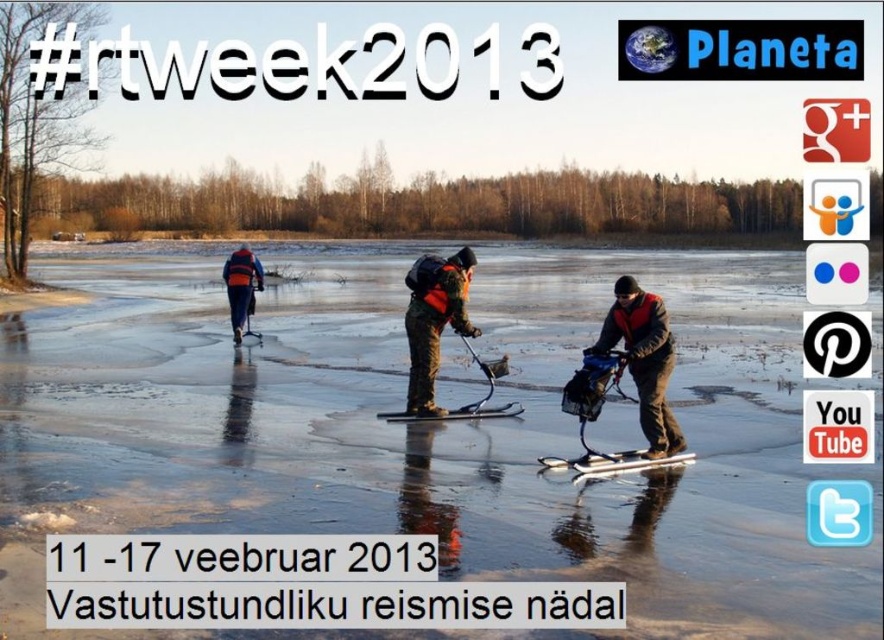
Consider the image. Can you confirm if dark gray fabric jacket at center is wider than camouflage jacket at center?

No, dark gray fabric jacket at center is not wider than camouflage jacket at center.

You are a GUI agent. You are given a task and a screenshot of the screen. Output one action in this format:
    pyautogui.click(x=<x>, y=<y>)
    Task: Click on the dark gray fabric jacket at center
    
    Given the screenshot: What is the action you would take?
    pyautogui.click(x=644, y=358)

Can you confirm if camouflage jacket at center is taller than orange life vest at center?

Indeed, camouflage jacket at center has a greater height compared to orange life vest at center.

Is camouflage jacket at center bigger than orange life vest at center?

Yes.

Is point (463, 323) less distant than point (237, 310)?

Yes, it is in front of point (237, 310).

Locate an element on the screen. camouflage jacket at center is located at coordinates (433, 321).

Does dark gray fabric jacket at center appear on the left side of orange life vest at center?

In fact, dark gray fabric jacket at center is to the right of orange life vest at center.

Is dark gray fabric jacket at center taller than orange life vest at center?

Incorrect, dark gray fabric jacket at center's height is not larger of orange life vest at center's.

From the picture: Who is more distant from viewer, (637, 326) or (240, 314)?

The point (240, 314) is behind.

This screenshot has width=884, height=640. Identify the location of dark gray fabric jacket at center. (644, 358).